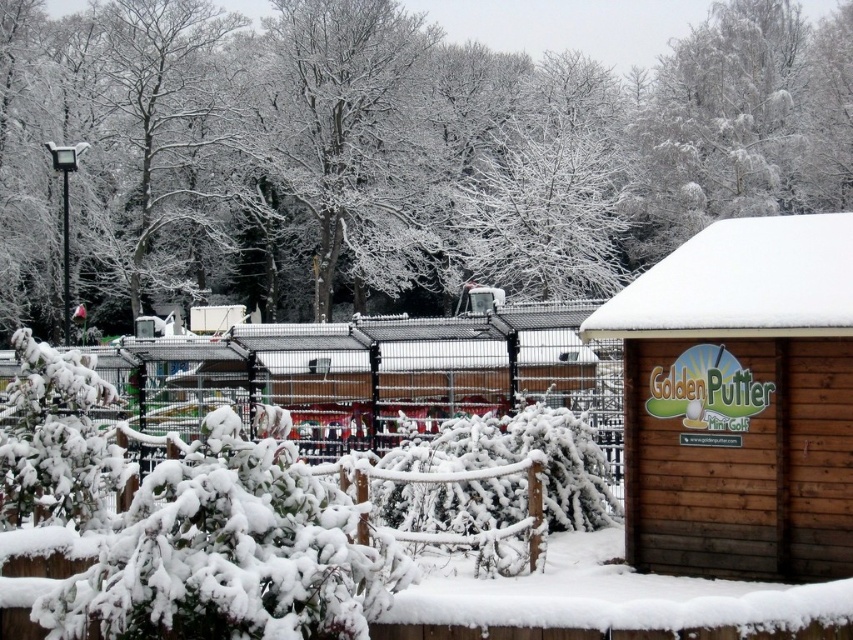
Does wooden hut at right have a larger size compared to white frosty tree at upper center?

Actually, wooden hut at right might be smaller than white frosty tree at upper center.

In the scene shown: Can you confirm if wooden hut at right is positioned to the right of white frosty tree at upper center?

Incorrect, wooden hut at right is not on the right side of white frosty tree at upper center.

Is point (769, 560) positioned before point (839, 186)?

Yes, point (769, 560) is in front of point (839, 186).

Locate an element on the screen. wooden hut at right is located at coordinates (740, 401).